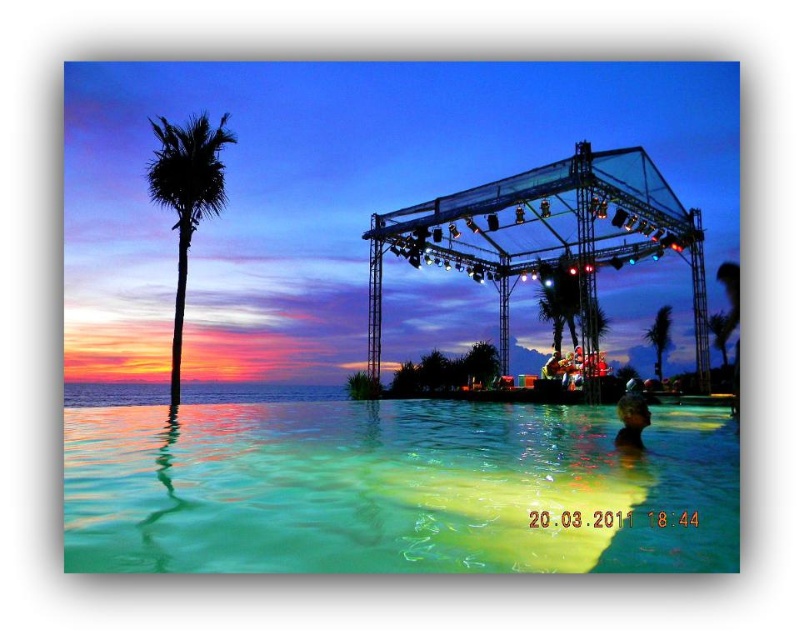
Question: Which point is farther from the camera taking this photo?

Choices:
 (A) (618, 416)
 (B) (655, 365)
 (C) (226, 522)
 (D) (177, 396)

Answer: (B)

Question: Is black silhouette palm tree at left to the right of smooth skin head at lower right from the viewer's perspective?

Choices:
 (A) yes
 (B) no

Answer: (B)

Question: Considering the relative positions of green translucent water at center and black silhouette palm tree at left in the image provided, where is green translucent water at center located with respect to black silhouette palm tree at left?

Choices:
 (A) below
 (B) above

Answer: (A)

Question: Based on their relative distances, which object is farther from the green translucent water at center?

Choices:
 (A) green leafy palm tree at center
 (B) smooth skin head at lower right
 (C) black silhouette palm tree at left

Answer: (C)

Question: Is black silhouette palm tree at left further to camera compared to green leafy palm tree at center?

Choices:
 (A) yes
 (B) no

Answer: (B)

Question: Estimate the real-world distances between objects in this image. Which object is closer to the green translucent water at center?

Choices:
 (A) green leafy palm tree at center
 (B) smooth skin head at lower right
 (C) black silhouette palm tree at left

Answer: (B)